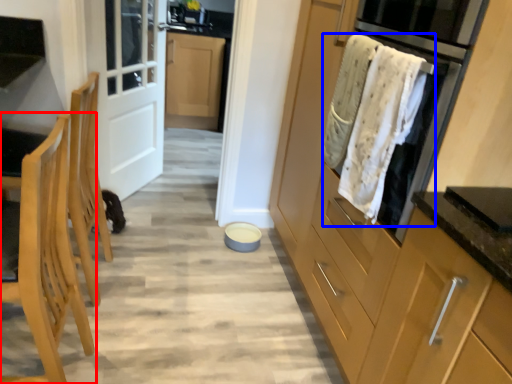
Question: Which point is closer to the camera, chair (highlighted by a red box) or blanket (highlighted by a blue box)?

Choices:
 (A) chair
 (B) blanket

Answer: (A)